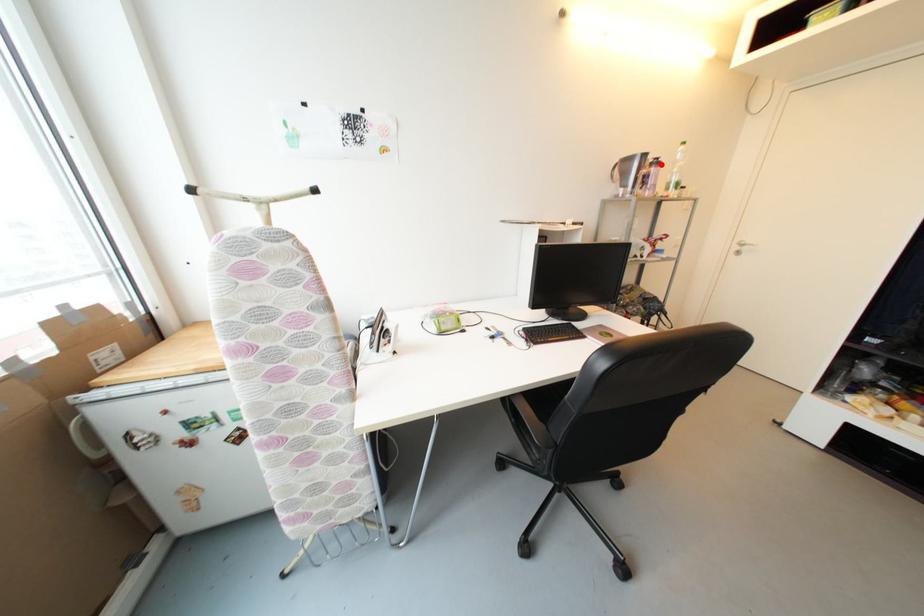
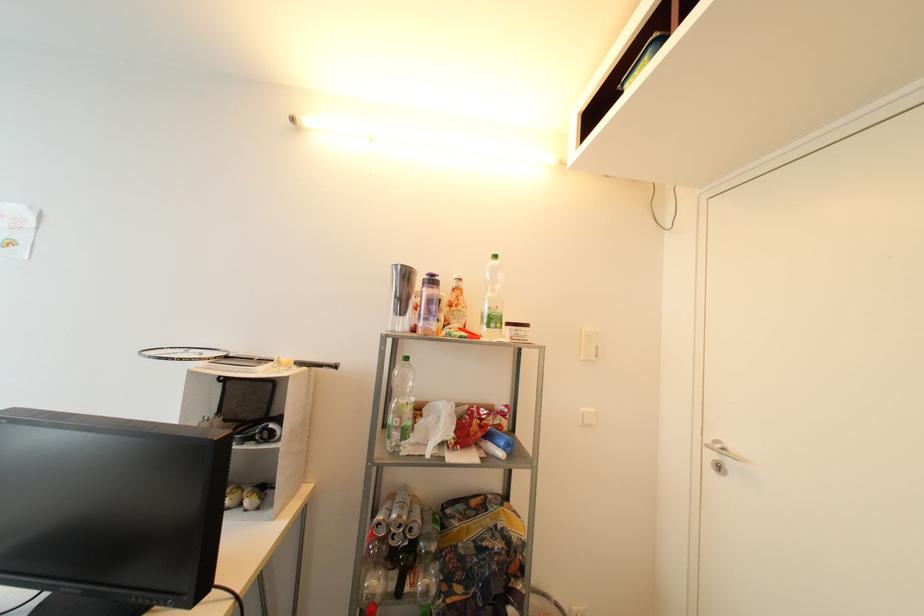
In the second image, find the point that corresponds to the highlighted location in the first image.

(438, 283)